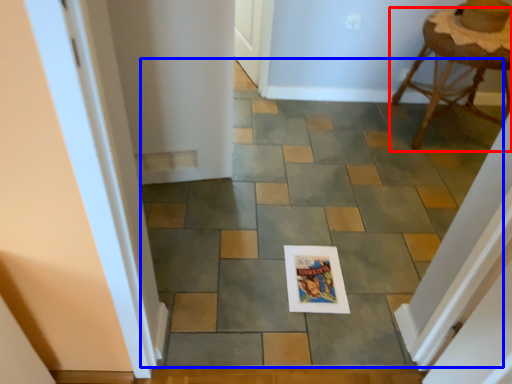
Question: Among these objects, which one is farthest to the camera, stool (highlighted by a red box) or path (highlighted by a blue box)?

Choices:
 (A) stool
 (B) path

Answer: (A)